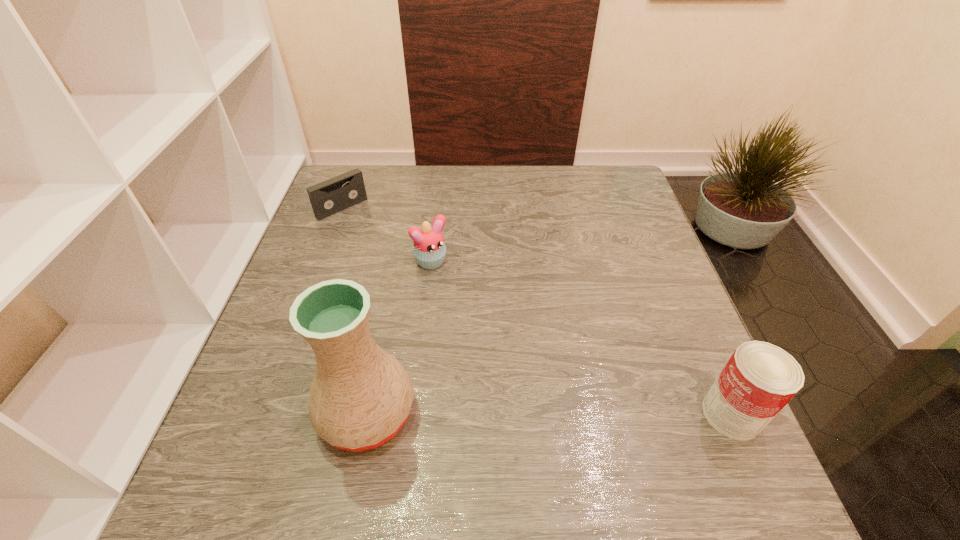
Find the location of `free space on the desktop that is between the tallest object and the rightmost object and is positioned on the face of the cupcake`. free space on the desktop that is between the tallest object and the rightmost object and is positioned on the face of the cupcake is located at coordinates (569, 414).

Image resolution: width=960 pixels, height=540 pixels. Identify the location of vacant space on the desktop that is between the tallest object and the rightmost object and is positioned on the front-facing side of the shortest object. (565, 414).